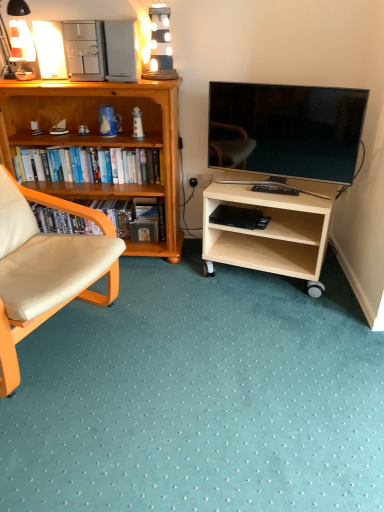
Question: Considering the positions of matte white lamp at upper left and black matte bookshelf at left, the second book in the top-to-bottom sequence, in the image, is matte white lamp at upper left wider or thinner than black matte bookshelf at left, the second book in the top-to-bottom sequence,?

Choices:
 (A) thin
 (B) wide

Answer: (B)

Question: Considering their positions, is matte white lamp at upper left located in front of or behind black matte bookshelf at left, the second book in the top-to-bottom sequence?

Choices:
 (A) front
 (B) behind

Answer: (A)

Question: Which is farther from the matte white lamp at upper left?

Choices:
 (A) hardcover books at left, the first book viewed from the top
 (B) light wood/finished wood tv stand at lower right, which ranks as the first desk in right-to-left order
 (C) wooden bookshelf at left, which appears as the first desk when viewed from the left
 (D) matte black tv at right
 (E) black matte bookshelf at left, which is the first book in bottom-to-top order

Answer: (B)

Question: Which object is the closest to the black matte bookshelf at left, which is the first book in bottom-to-top order?

Choices:
 (A) matte black tv at right
 (B) matte white lamp at upper left
 (C) wooden bookshelf at left, positioned as the 2th desk in right-to-left order
 (D) beige leather chair at left
 (E) hardcover books at left, the first book viewed from the top

Answer: (E)